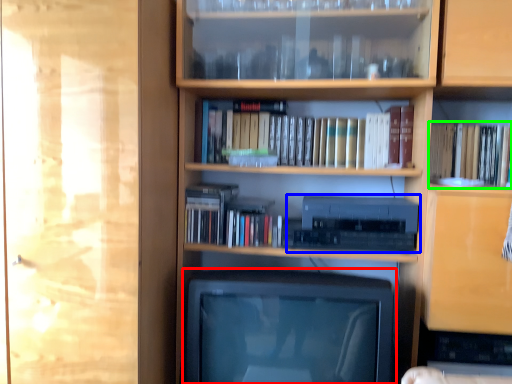
Question: Based on their relative distances, which object is farther from television (highlighted by a red box)? Choose from stereo (highlighted by a blue box) and book (highlighted by a green box).

Choices:
 (A) stereo
 (B) book

Answer: (B)